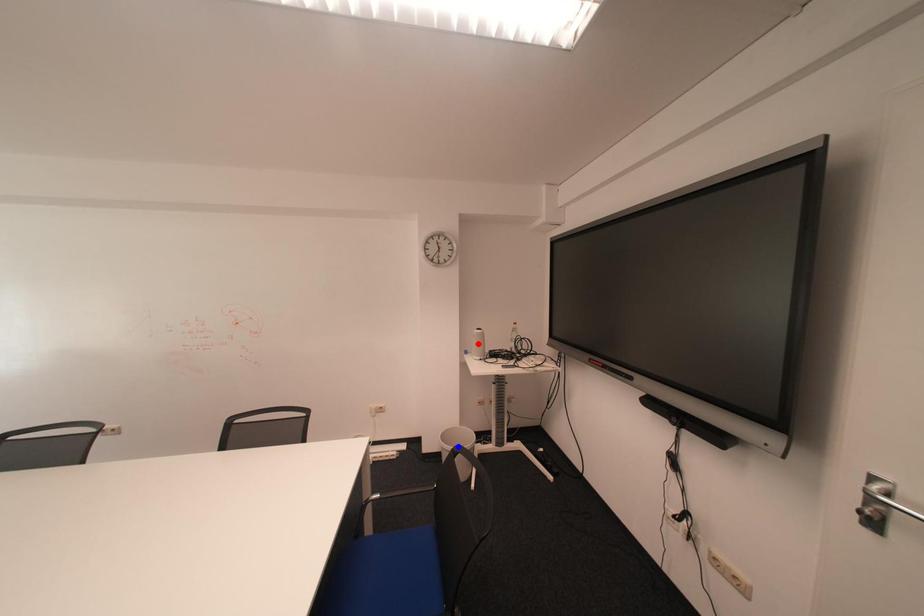
Question: In the image, two points are highlighted. Which point is nearer to the camera? Reply with the corresponding letter.

Choices:
 (A) blue point
 (B) red point

Answer: (B)